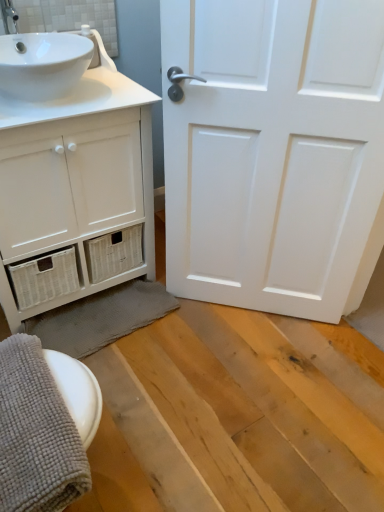
Question: Is white glossy sink at upper left aimed at gray textured bath towel at lower left, which is counted as the second bath towel, starting from the front?

Choices:
 (A) yes
 (B) no

Answer: (B)

Question: Is white glossy sink at upper left outside of gray textured bath towel at lower left, which is counted as the second bath towel, starting from the front?

Choices:
 (A) yes
 (B) no

Answer: (A)

Question: Considering the relative sizes of white glossy sink at upper left and gray textured bath towel at lower left, the first bath towel viewed from the back, in the image provided, is white glossy sink at upper left thinner than gray textured bath towel at lower left, the first bath towel viewed from the back,?

Choices:
 (A) no
 (B) yes

Answer: (A)

Question: From the image's perspective, is white glossy sink at upper left located above gray textured bath towel at lower left, which is counted as the second bath towel, starting from the front?

Choices:
 (A) no
 (B) yes

Answer: (B)

Question: Would you say gray textured bath towel at lower left, the first bath towel viewed from the back, is part of white glossy sink at upper left's contents?

Choices:
 (A) yes
 (B) no

Answer: (B)

Question: Does white glossy sink at upper left have a greater height compared to gray textured bath towel at lower left, which is counted as the second bath towel, starting from the front?

Choices:
 (A) yes
 (B) no

Answer: (A)

Question: Is gray textured bath towel at lower left, which is counted as the second bath towel, starting from the front, surrounding white matte door at center?

Choices:
 (A) yes
 (B) no

Answer: (B)

Question: From the image's perspective, is gray textured bath towel at lower left, the first bath towel viewed from the back, under white matte door at center?

Choices:
 (A) no
 (B) yes

Answer: (B)

Question: Is gray textured bath towel at lower left, which is counted as the second bath towel, starting from the front, at the left side of white matte door at center?

Choices:
 (A) no
 (B) yes

Answer: (B)

Question: Is gray textured bath towel at lower left, the first bath towel viewed from the back, taller than white matte door at center?

Choices:
 (A) yes
 (B) no

Answer: (B)

Question: Is gray textured bath towel at lower left, which is counted as the second bath towel, starting from the front, at the right side of white matte door at center?

Choices:
 (A) no
 (B) yes

Answer: (A)

Question: Considering the relative sizes of gray textured bath towel at lower left, the first bath towel viewed from the back, and white matte door at center in the image provided, is gray textured bath towel at lower left, the first bath towel viewed from the back, wider than white matte door at center?

Choices:
 (A) no
 (B) yes

Answer: (B)

Question: Is white glossy sink at upper left positioned beyond the bounds of white matte door at center?

Choices:
 (A) yes
 (B) no

Answer: (A)